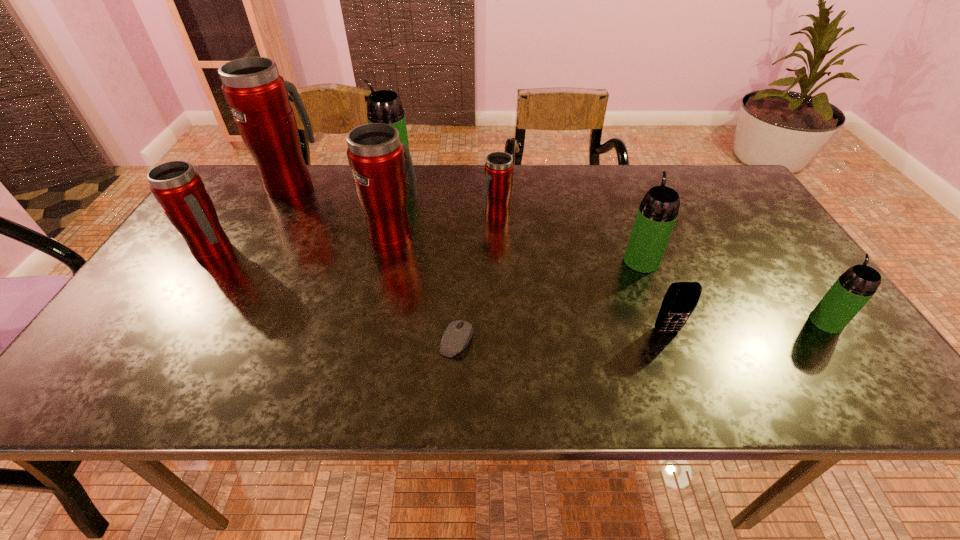
This screenshot has width=960, height=540. I want to click on object that is the eighth nearest to the fifth thermos bottle from left to right, so click(854, 288).

Locate an element on the screen. This screenshot has width=960, height=540. thermos bottle that can be found as the seventh closest to the second shortest object is located at coordinates (180, 191).

Identify which thermos bottle is the fourth nearest to the second biggest red thermos bottle. Please provide its 2D coordinates. Your answer should be formatted as a tuple, i.e. [(x, y)], where the tuple contains the x and y coordinates of a point satisfying the conditions above.

[(180, 191)]

This screenshot has height=540, width=960. I want to click on red thermos bottle that is the closest to the sixth object from left to right, so click(380, 163).

Find the location of a particular element. The height and width of the screenshot is (540, 960). red thermos bottle identified as the second closest to the fourth object from right to left is located at coordinates (258, 97).

Identify which green thermos bottle is the second nearest to the sixth object from left to right. Please provide its 2D coordinates. Your answer should be formatted as a tuple, i.e. [(x, y)], where the tuple contains the x and y coordinates of a point satisfying the conditions above.

[(658, 211)]

Find the location of a particular element. This screenshot has width=960, height=540. green thermos bottle that is the second closest to the fifth thermos bottle from left to right is located at coordinates (658, 211).

Find the location of `vacant space that satisfies the following two spatial constraints: 1. from the spout of the computer equipment; 2. on the left side of the leftmost green thermos bottle`. vacant space that satisfies the following two spatial constraints: 1. from the spout of the computer equipment; 2. on the left side of the leftmost green thermos bottle is located at coordinates (353, 340).

Image resolution: width=960 pixels, height=540 pixels. What are the coordinates of `vacant area that satisfies the following two spatial constraints: 1. on the side with the handle of the third biggest red thermos bottle; 2. from the spout of the rightmost thermos bottle` in the screenshot? It's located at pyautogui.click(x=171, y=322).

Where is `free space in the image that satisfies the following two spatial constraints: 1. on the side with the handle of the third biggest red thermos bottle; 2. from the spout of the rightmost object`? free space in the image that satisfies the following two spatial constraints: 1. on the side with the handle of the third biggest red thermos bottle; 2. from the spout of the rightmost object is located at coordinates (171, 322).